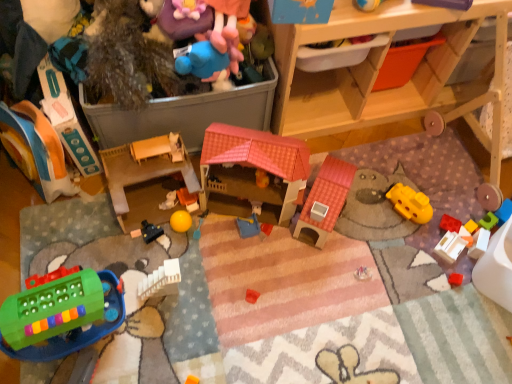
Locate an element on the screen. The height and width of the screenshot is (384, 512). free space to the back side of translucent orange cube at center, which ranks as the eleventh toy in left-to-right order is located at coordinates [453, 203].